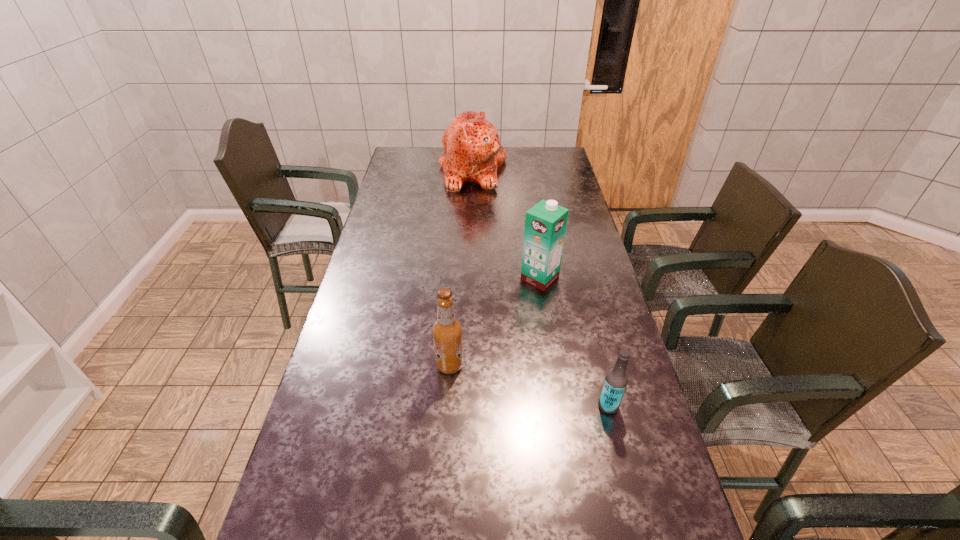
This screenshot has height=540, width=960. Find the location of `cat`. cat is located at coordinates (472, 153).

At what (x,y) coordinates should I click in order to perform the action: click on carton. Please return your answer as a coordinate pair (x, y). This screenshot has width=960, height=540. Looking at the image, I should click on (545, 223).

You are a GUI agent. You are given a task and a screenshot of the screen. Output one action in this format:
    pyautogui.click(x=<x>, y=<y>)
    Task: Click on the third nearest object
    The height and width of the screenshot is (540, 960).
    Given the screenshot: What is the action you would take?
    pyautogui.click(x=545, y=223)

This screenshot has width=960, height=540. Identify the location of the taller beer bottle. (447, 330).

The image size is (960, 540). In order to click on the farther beer bottle in this screenshot , I will do [x=447, y=330].

Where is `the shortest object`? The width and height of the screenshot is (960, 540). the shortest object is located at coordinates (616, 379).

Where is `the rightmost object`? Image resolution: width=960 pixels, height=540 pixels. the rightmost object is located at coordinates point(616,379).

Locate an element on the screen. The width and height of the screenshot is (960, 540). vacant space located on the face of the farthest object is located at coordinates (551, 168).

This screenshot has width=960, height=540. In order to click on vacant space located on the left of the carton in this screenshot , I will do `click(482, 278)`.

This screenshot has height=540, width=960. I want to click on vacant region located on the front label of the left beer bottle, so click(x=597, y=365).